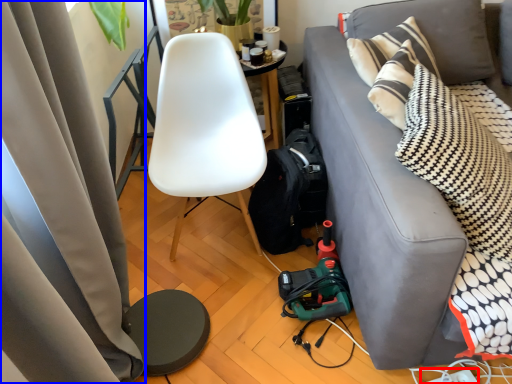
Question: Which point is further to the camera, power outlet (highlighted by a red box) or curtain (highlighted by a blue box)?

Choices:
 (A) power outlet
 (B) curtain

Answer: (A)